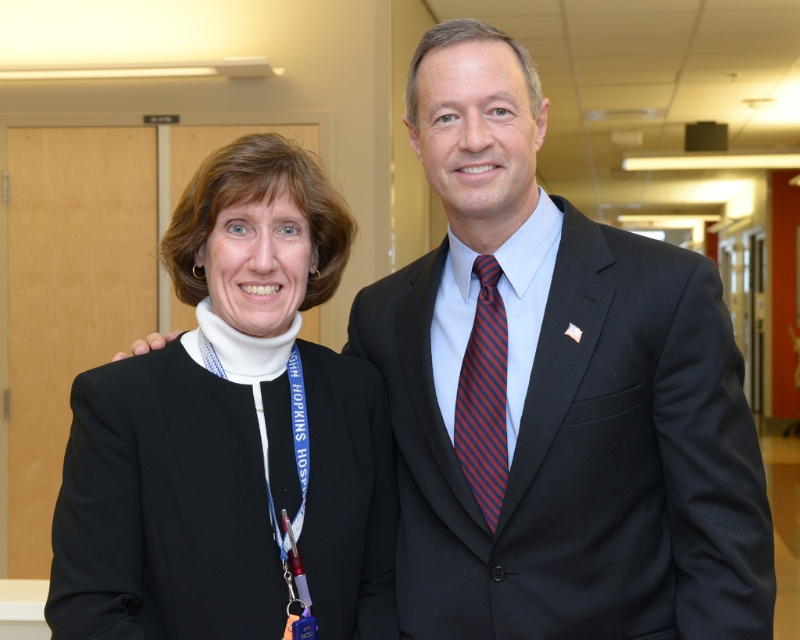
Which is in front, point (534, 481) or point (220, 474)?

Point (220, 474) is in front.

Is matte black suit at center to the left of black woolen blazer at left from the viewer's perspective?

No, matte black suit at center is not to the left of black woolen blazer at left.

I want to click on matte black suit at center, so click(x=556, y=394).

Locate an element on the screen. Image resolution: width=800 pixels, height=640 pixels. matte black suit at center is located at coordinates (556, 394).

Is black woolen blazer at left positioned behind striped silk tie at center?

No, it is in front of striped silk tie at center.

Locate an element on the screen. black woolen blazer at left is located at coordinates 230,433.

Does matte black suit at center have a lesser height compared to striped silk tie at center?

In fact, matte black suit at center may be taller than striped silk tie at center.

Can you confirm if matte black suit at center is thinner than striped silk tie at center?

No, matte black suit at center is not thinner than striped silk tie at center.

Who is more forward, (x=578, y=308) or (x=470, y=392)?

Point (x=578, y=308) is in front.

In order to click on matte black suit at center in this screenshot , I will do `click(556, 394)`.